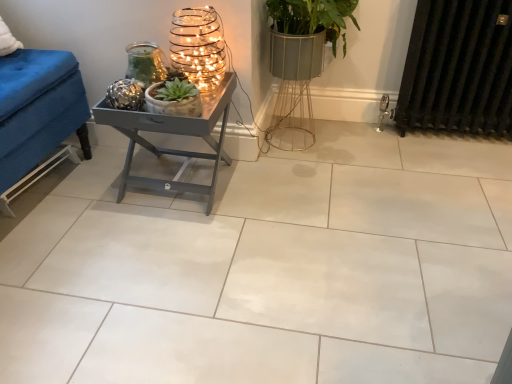
Identify the location of free point to the left of metallic gray table at center. This screenshot has height=384, width=512. (91, 182).